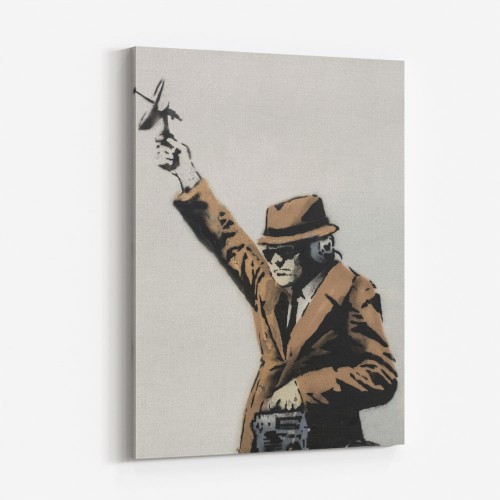
Locate an element on the screen. artwork is located at coordinates point(227,311).